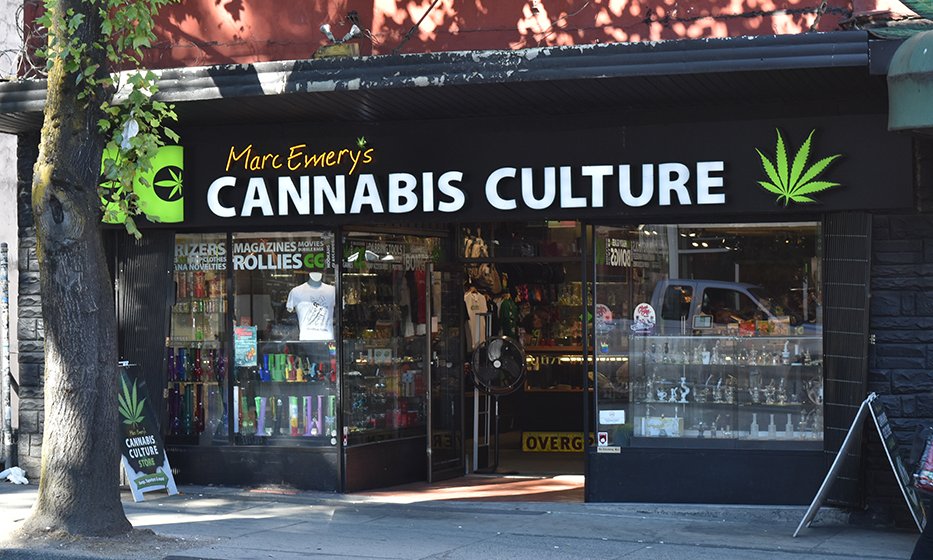
Image resolution: width=933 pixels, height=560 pixels. In order to click on poster in window in this screenshot , I will do `click(244, 344)`.